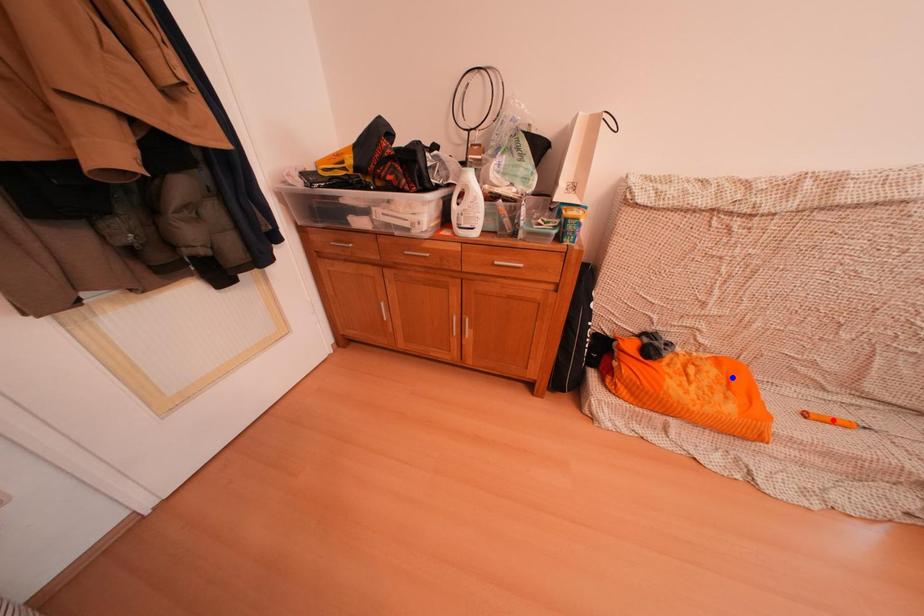
Question: Which of the two points in the image is closer to the camera?

Choices:
 (A) Blue point is closer.
 (B) Red point is closer.

Answer: (B)